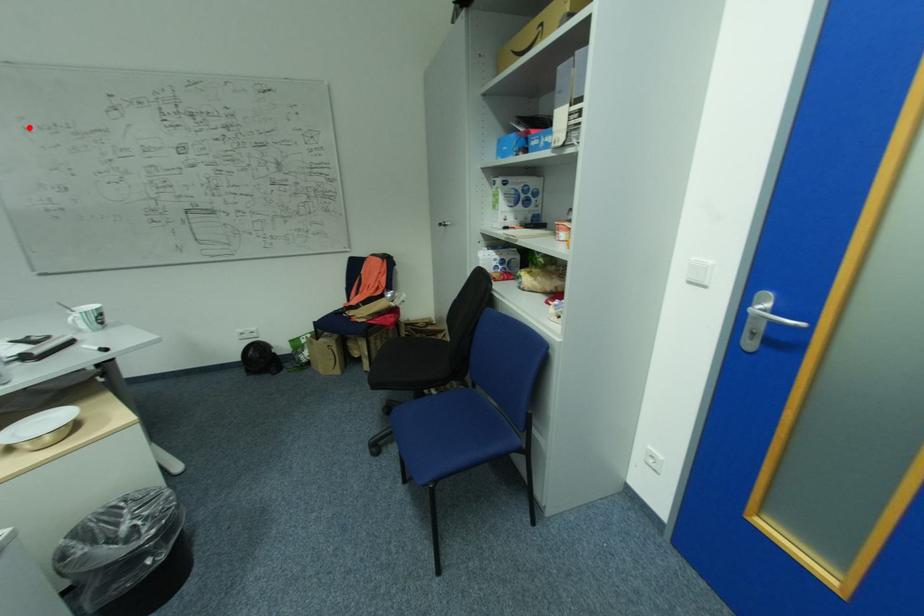
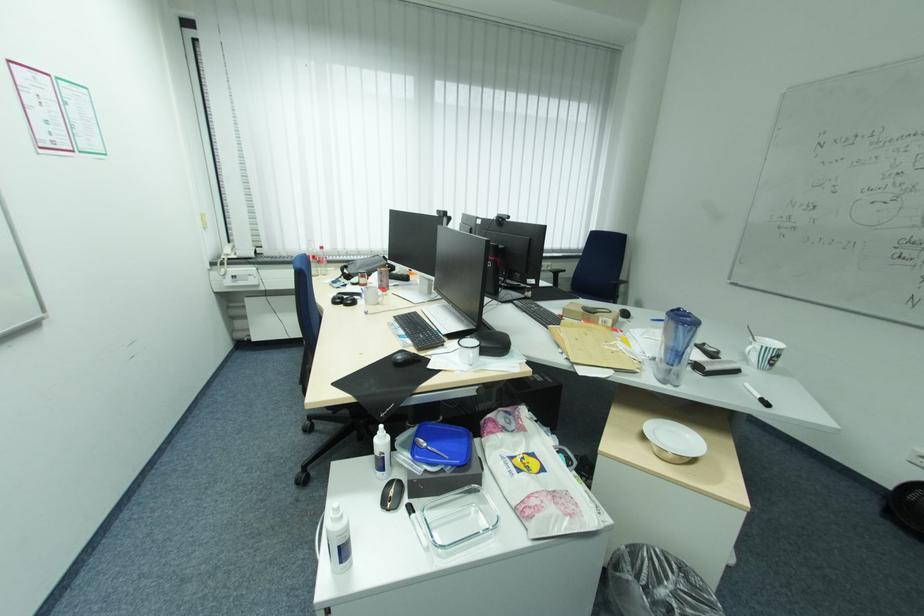
Find the pixel in the second image that matches the highlighted location in the first image.

(827, 144)